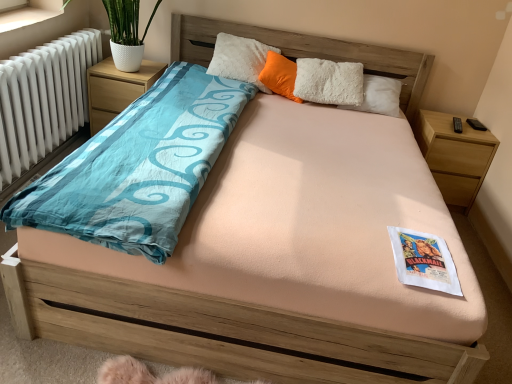
Question: Can you confirm if wooden nightstand at right, the 2th nightstand from the left, is thinner than wooden nightstand at left, the 2th nightstand from the right?

Choices:
 (A) no
 (B) yes

Answer: (B)

Question: Does wooden nightstand at right, the 1th nightstand in the right-to-left sequence, appear on the right side of wooden nightstand at left, the 2th nightstand from the right?

Choices:
 (A) no
 (B) yes

Answer: (B)

Question: Does wooden nightstand at right, the 1th nightstand in the right-to-left sequence, have a greater height compared to wooden nightstand at left, the first nightstand in the left-to-right sequence?

Choices:
 (A) yes
 (B) no

Answer: (A)

Question: Is wooden nightstand at right, the 1th nightstand in the right-to-left sequence, smaller than wooden nightstand at left, the first nightstand in the left-to-right sequence?

Choices:
 (A) yes
 (B) no

Answer: (B)

Question: Considering the relative sizes of wooden nightstand at right, the 1th nightstand in the right-to-left sequence, and wooden nightstand at left, the first nightstand in the left-to-right sequence, in the image provided, is wooden nightstand at right, the 1th nightstand in the right-to-left sequence, shorter than wooden nightstand at left, the first nightstand in the left-to-right sequence,?

Choices:
 (A) yes
 (B) no

Answer: (B)

Question: In terms of height, does wooden nightstand at left, the 2th nightstand from the right, look taller or shorter compared to wooden nightstand at right, the 2th nightstand from the left?

Choices:
 (A) tall
 (B) short

Answer: (B)

Question: From the image's perspective, is wooden nightstand at left, the 2th nightstand from the right, above or below wooden nightstand at right, the 2th nightstand from the left?

Choices:
 (A) above
 (B) below

Answer: (A)

Question: From a real-world perspective, is wooden nightstand at left, the 2th nightstand from the right, physically located above or below wooden nightstand at right, the 1th nightstand in the right-to-left sequence?

Choices:
 (A) below
 (B) above

Answer: (B)

Question: Is wooden nightstand at left, the first nightstand in the left-to-right sequence, inside or outside of wooden nightstand at right, the 2th nightstand from the left?

Choices:
 (A) outside
 (B) inside

Answer: (A)

Question: From the image's perspective, is wooden nightstand at right, the 2th nightstand from the left, positioned above or below white paper at center?

Choices:
 (A) below
 (B) above

Answer: (B)

Question: Considering the positions of wooden nightstand at right, the 2th nightstand from the left, and white paper at center in the image, is wooden nightstand at right, the 2th nightstand from the left, taller or shorter than white paper at center?

Choices:
 (A) short
 (B) tall

Answer: (B)

Question: Based on their sizes in the image, would you say wooden nightstand at right, the 1th nightstand in the right-to-left sequence, is bigger or smaller than white paper at center?

Choices:
 (A) big
 (B) small

Answer: (A)

Question: Is wooden nightstand at right, the 1th nightstand in the right-to-left sequence, wider or thinner than white paper at center?

Choices:
 (A) wide
 (B) thin

Answer: (A)

Question: Is orange fluffy pillow at center inside the boundaries of white paper at center, or outside?

Choices:
 (A) inside
 (B) outside

Answer: (B)

Question: Does point (288, 89) appear closer or farther from the camera than point (393, 241)?

Choices:
 (A) closer
 (B) farther

Answer: (B)